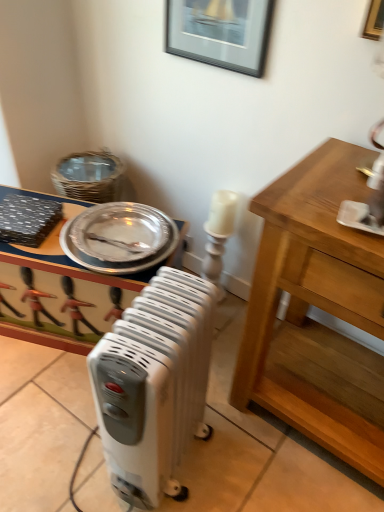
In order to face black glossy picture frame at upper center, should I rotate leftwards or rightwards?

A 3.057 degree turn to the right will do.

What is the approximate width of silver metallic platter at upper left?

15.49 inches.

This screenshot has width=384, height=512. What do you see at coordinates (153, 382) in the screenshot?
I see `white plastic radiator at center` at bounding box center [153, 382].

This screenshot has width=384, height=512. Find the location of `black glossy picture frame at upper center`. black glossy picture frame at upper center is located at coordinates (220, 32).

Between metallic silver tray at center and black glossy picture frame at upper center, which one has smaller size?

Smaller between the two is black glossy picture frame at upper center.

Consider the image. From the image's perspective, is metallic silver tray at center above or below black glossy picture frame at upper center?

Based on their image positions, metallic silver tray at center is located beneath black glossy picture frame at upper center.

Which object is positioned more to the left, metallic silver tray at center or black glossy picture frame at upper center?

From the viewer's perspective, metallic silver tray at center appears more on the left side.

Who is taller, silver metallic platter at upper left or metallic silver tray at center?

Standing taller between the two is metallic silver tray at center.

From the image's perspective, is silver metallic platter at upper left above or below metallic silver tray at center?

Based on their image positions, silver metallic platter at upper left is located above metallic silver tray at center.

Does silver metallic platter at upper left contain metallic silver tray at center?

No, metallic silver tray at center is not a part of silver metallic platter at upper left.

Is silver metallic platter at upper left positioned beyond the bounds of black glossy picture frame at upper center?

Absolutely, silver metallic platter at upper left is external to black glossy picture frame at upper center.

From the image's perspective, would you say silver metallic platter at upper left is positioned over black glossy picture frame at upper center?

Actually, silver metallic platter at upper left appears below black glossy picture frame at upper center in the image.

Is silver metallic platter at upper left next to black glossy picture frame at upper center?

silver metallic platter at upper left is not next to black glossy picture frame at upper center, and they're not touching.

Does metallic silver tray at center come behind silver metallic platter at upper left?

Yes.

Is metallic silver tray at center bigger than silver metallic platter at upper left?

Indeed, metallic silver tray at center has a larger size compared to silver metallic platter at upper left.

Is silver metallic platter at upper left at the back of metallic silver tray at center?

No.

Identify the location of desk that appears behind the silver metallic platter at upper left. Image resolution: width=384 pixels, height=512 pixels. (59, 290).

From the image's perspective, which one is positioned higher, metallic silver tray at center or white plastic radiator at center?

metallic silver tray at center appears higher in the image.

Considering the sizes of objects metallic silver tray at center and white plastic radiator at center in the image provided, who is wider, metallic silver tray at center or white plastic radiator at center?

metallic silver tray at center is wider.

Is point (92, 338) closer to camera compared to point (146, 380)?

No.

Is metallic silver tray at center to the left of white plastic radiator at center from the viewer's perspective?

Correct, you'll find metallic silver tray at center to the left of white plastic radiator at center.

Considering the sizes of objects black glossy picture frame at upper center and metallic silver tray at center in the image provided, who is thinner, black glossy picture frame at upper center or metallic silver tray at center?

Thinner between the two is black glossy picture frame at upper center.

Identify the location of desk that is below the black glossy picture frame at upper center (from the image's perspective). (59, 290).

Looking at this image, from their relative heights in the image, would you say black glossy picture frame at upper center is taller or shorter than metallic silver tray at center?

Considering their sizes, black glossy picture frame at upper center has less height than metallic silver tray at center.

Can metallic silver tray at center be found inside black glossy picture frame at upper center?

No, black glossy picture frame at upper center does not contain metallic silver tray at center.

From the image's perspective, would you say white plastic radiator at center is shown under metallic silver tray at center?

Yes.

Consider the image. Is white plastic radiator at center thinner than metallic silver tray at center?

Yes.

You are a GUI agent. You are given a task and a screenshot of the screen. Output one action in this format:
    pyautogui.click(x=<x>, y=<y>)
    Task: Click on the desk that appears behind the black glossy picture frame at upper center
    This screenshot has width=384, height=512.
    Given the screenshot: What is the action you would take?
    pyautogui.click(x=59, y=290)

Identify the location of desk below the silver metallic platter at upper left (from the image's perspective). This screenshot has height=512, width=384. (59, 290).

Considering their positions, is black glossy picture frame at upper center positioned further to metallic silver tray at center than white plastic radiator at center?

The object further to metallic silver tray at center is black glossy picture frame at upper center.

Looking at the image, which one is located further to metallic silver tray at center, white plastic radiator at center or black glossy picture frame at upper center?

black glossy picture frame at upper center is further to metallic silver tray at center.

Looking at the image, which one is located closer to white plastic radiator at center, black glossy picture frame at upper center or metallic silver tray at center?

metallic silver tray at center lies closer to white plastic radiator at center than the other object.

Considering their positions, is silver metallic platter at upper left positioned further to black glossy picture frame at upper center than metallic silver tray at center?

metallic silver tray at center is further to black glossy picture frame at upper center.

When comparing their distances from black glossy picture frame at upper center, does metallic silver tray at center or silver metallic platter at upper left seem closer?

Among the two, silver metallic platter at upper left is located nearer to black glossy picture frame at upper center.

Estimate the real-world distances between objects in this image. Which object is closer to metallic silver tray at center, black glossy picture frame at upper center or silver metallic platter at upper left?

Among the two, silver metallic platter at upper left is located nearer to metallic silver tray at center.

From the image, which object appears to be nearer to silver metallic platter at upper left, metallic silver tray at center or black glossy picture frame at upper center?

Based on the image, metallic silver tray at center appears to be nearer to silver metallic platter at upper left.

From the image, which object appears to be nearer to black glossy picture frame at upper center, white plastic radiator at center or metallic silver tray at center?

metallic silver tray at center is closer to black glossy picture frame at upper center.

Where is `platter between black glossy picture frame at upper center and white plastic radiator at center in the vertical direction`? The height and width of the screenshot is (512, 384). platter between black glossy picture frame at upper center and white plastic radiator at center in the vertical direction is located at coordinates (119, 237).

Identify the location of desk that lies between black glossy picture frame at upper center and white plastic radiator at center from top to bottom. The width and height of the screenshot is (384, 512). (59, 290).

Where is `platter between white plastic radiator at center and metallic silver tray at center from front to back`? Image resolution: width=384 pixels, height=512 pixels. platter between white plastic radiator at center and metallic silver tray at center from front to back is located at coordinates (119, 237).

Where is `platter between black glossy picture frame at upper center and metallic silver tray at center in the up-down direction`? This screenshot has height=512, width=384. platter between black glossy picture frame at upper center and metallic silver tray at center in the up-down direction is located at coordinates (119, 237).